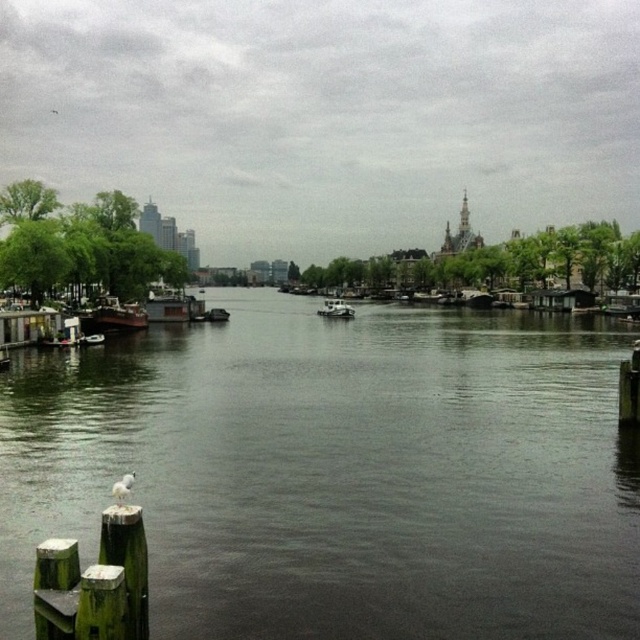
Question: Which point appears farthest from the camera in this image?

Choices:
 (A) (102, 308)
 (B) (323, 308)

Answer: (B)

Question: Is wooden houseboat at left positioned behind white matte boat at center?

Choices:
 (A) yes
 (B) no

Answer: (B)

Question: Does dark gray water at center appear under white matte boat at center?

Choices:
 (A) no
 (B) yes

Answer: (B)

Question: Which of the following is the closest to the observer?

Choices:
 (A) dark gray water at center
 (B) white matte boat at center

Answer: (A)

Question: Is dark gray water at center further to the viewer compared to wooden houseboat at left?

Choices:
 (A) no
 (B) yes

Answer: (A)

Question: Considering the real-world distances, which object is closest to the wooden houseboat at left?

Choices:
 (A) dark gray water at center
 (B) white matte boat at center

Answer: (A)